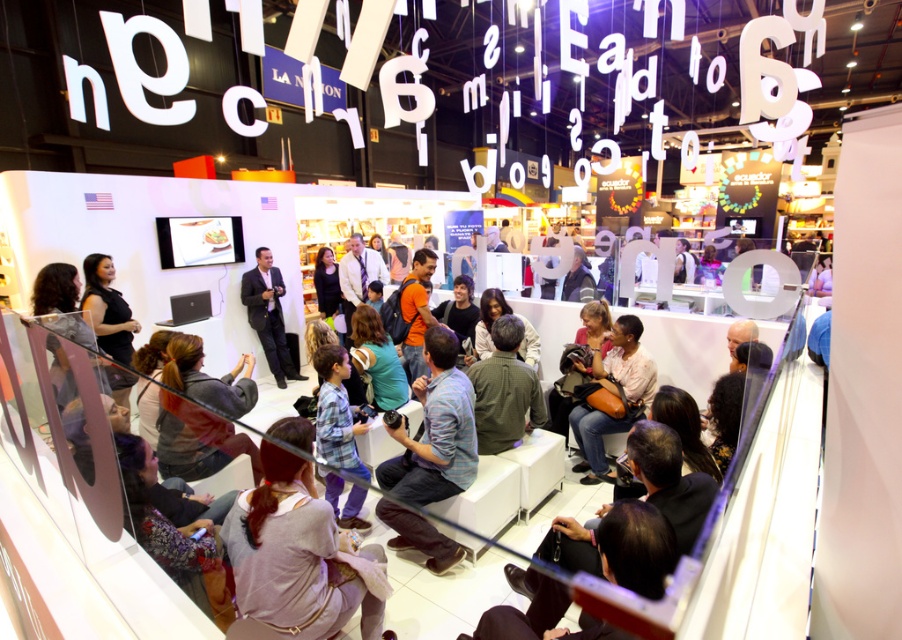
You are attending an event and see two people in the center area wearing a plaid shirt at center and a black suit at center. Which one is standing to the right of the other?

The plaid shirt at center is positioned on the right side of black suit at center, so the person in the plaid shirt at center is standing to the right of the person in the black suit at center.